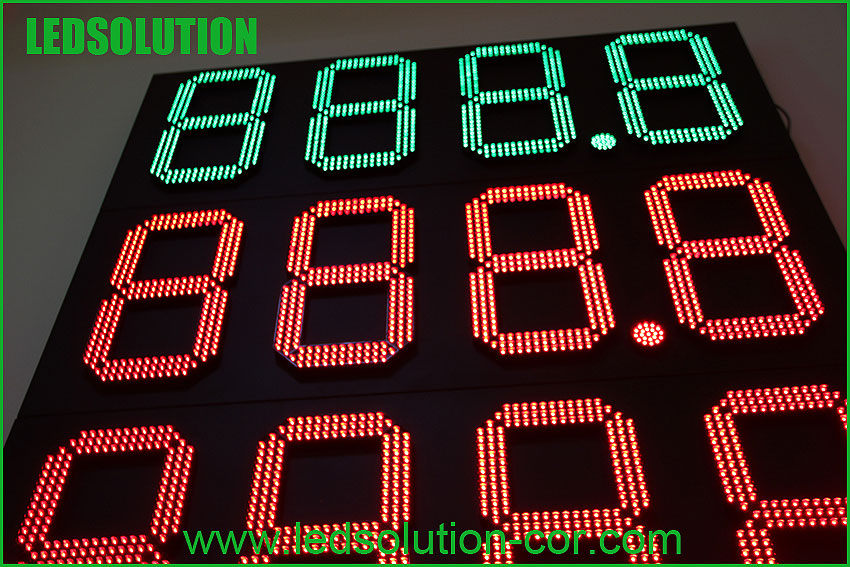
Find the location of a particular element. led is located at coordinates (65, 46).